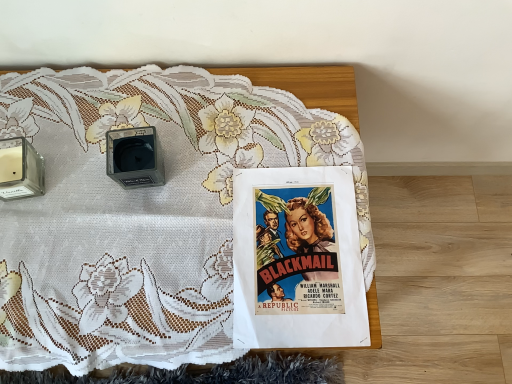
Where is `free space above matte paper poster at center (from a real-world perspective)`? The image size is (512, 384). free space above matte paper poster at center (from a real-world perspective) is located at coordinates (298, 244).